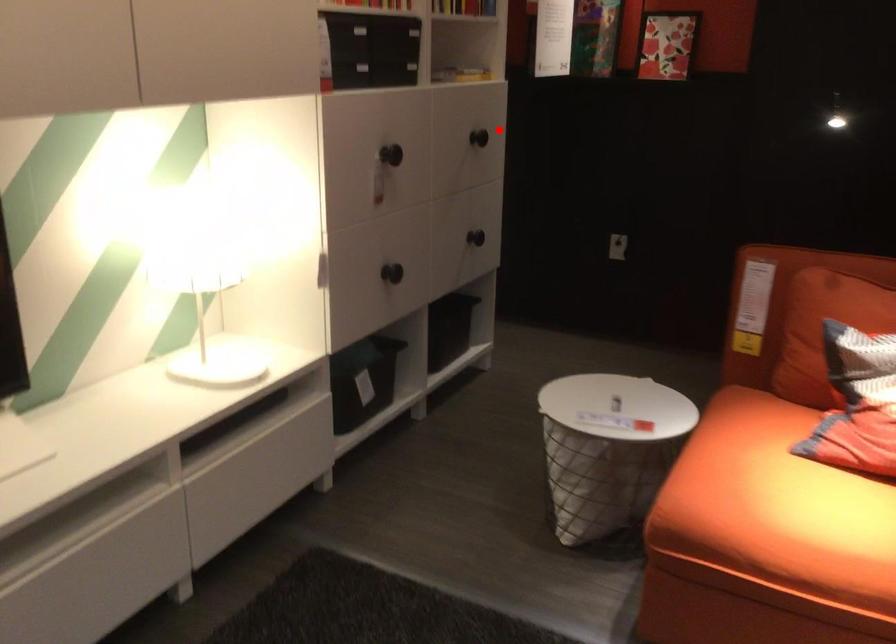
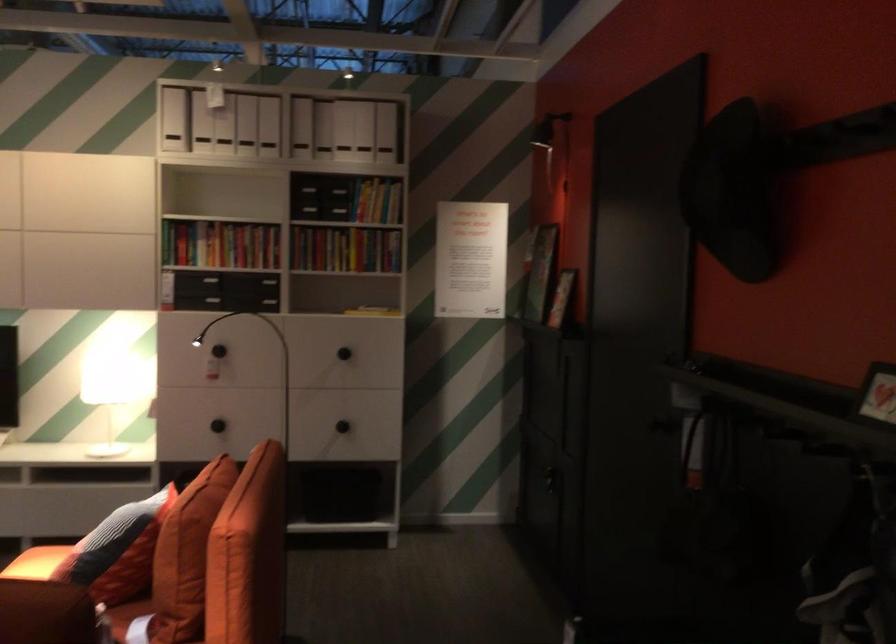
Where in the second image is the point corresponding to the highlighted location from the first image?

(343, 353)